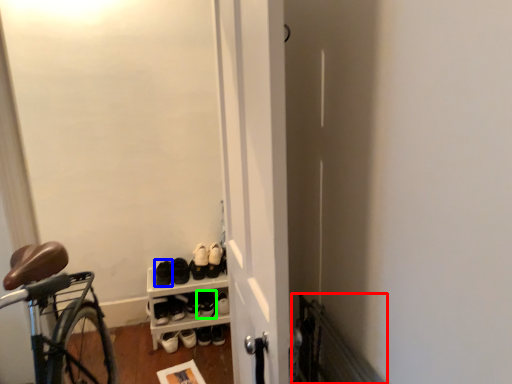
Question: Which object is the closest to the radiator (highlighted by a red box)? Choose among these: footwear (highlighted by a blue box) or footwear (highlighted by a green box).

Choices:
 (A) footwear
 (B) footwear

Answer: (B)